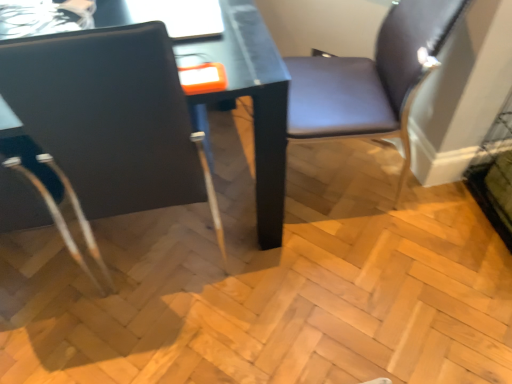
Where is `vacant space to the right of matte black chair at left, arranged as the 2th chair when viewed from the right`? The image size is (512, 384). vacant space to the right of matte black chair at left, arranged as the 2th chair when viewed from the right is located at coordinates (295, 273).